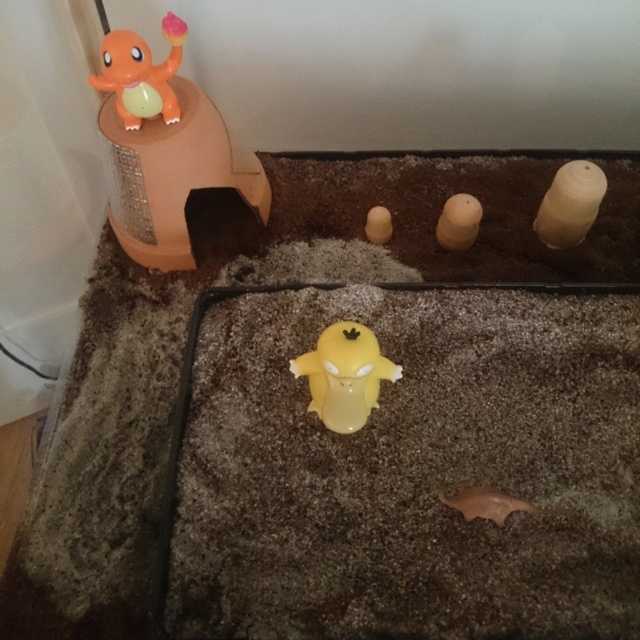
Is matte orange plastic charmander at upper left wider than matte brown egg at center?

Correct, the width of matte orange plastic charmander at upper left exceeds that of matte brown egg at center.

Where is `matte orange plastic charmander at upper left`? Image resolution: width=640 pixels, height=640 pixels. matte orange plastic charmander at upper left is located at coordinates (140, 74).

Looking at this image, is orange matte plastic toy at upper left wider than matte brown egg at center?

Correct, the width of orange matte plastic toy at upper left exceeds that of matte brown egg at center.

Can you confirm if orange matte plastic toy at upper left is bigger than matte brown egg at center?

Yes.

Where is `orange matte plastic toy at upper left`? orange matte plastic toy at upper left is located at coordinates (164, 147).

At what (x,y) coordinates should I click in order to perform the action: click on orange matte plastic toy at upper left. Please return your answer as a coordinate pair (x, y). The height and width of the screenshot is (640, 640). Looking at the image, I should click on (x=164, y=147).

Is point (182, 205) closer to camera compared to point (173, 20)?

No, (182, 205) is behind (173, 20).

Is orange matte plastic toy at upper left wider than matte orange plastic charmander at upper left?

Indeed, orange matte plastic toy at upper left has a greater width compared to matte orange plastic charmander at upper left.

At what (x,y) coordinates should I click in order to perform the action: click on orange matte plastic toy at upper left. Please return your answer as a coordinate pair (x, y). The height and width of the screenshot is (640, 640). Looking at the image, I should click on (164, 147).